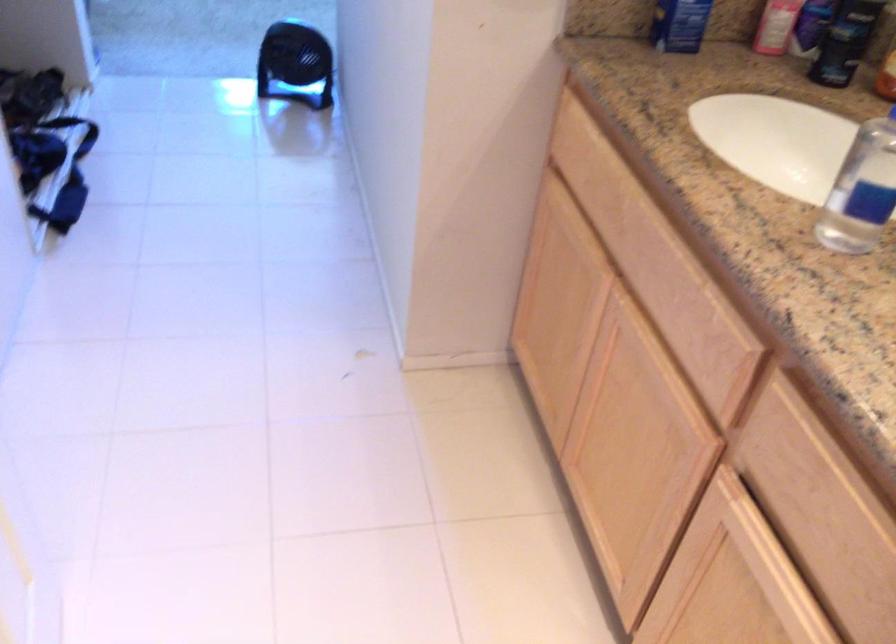
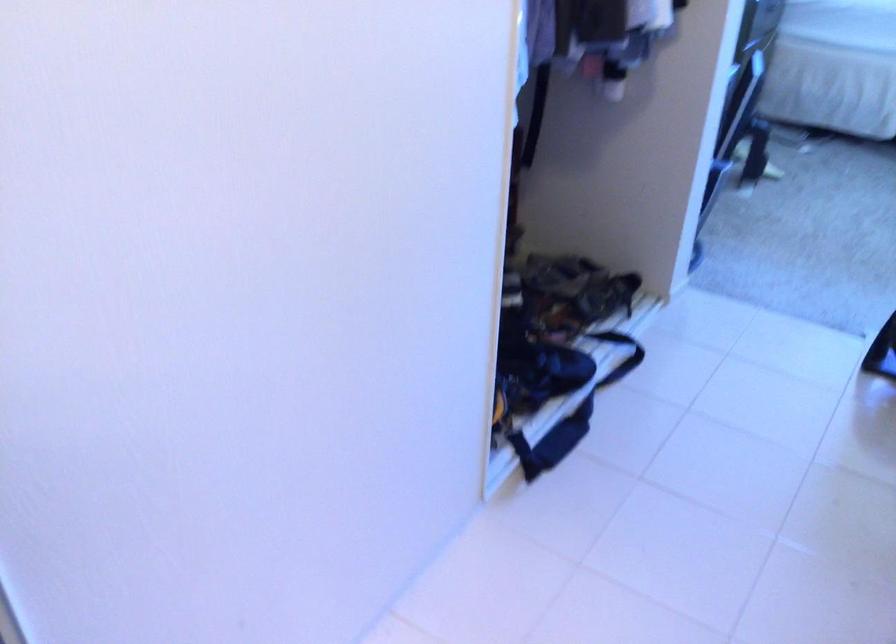
In the second image, find the point that corresponds to point (90, 137) in the first image.

(621, 355)